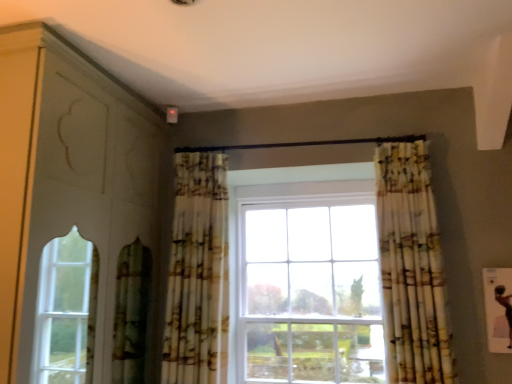
Question: In terms of size, does matte white dresser at left appear bigger or smaller than printed fabric curtain at right, marked as the second curtain in a left-to-right arrangement?

Choices:
 (A) big
 (B) small

Answer: (A)

Question: Relative to printed fabric curtain at right, placed as the 1th curtain when sorted from right to left, is matte white dresser at left in front or behind?

Choices:
 (A) behind
 (B) front

Answer: (B)

Question: Which object is the farthest from the matte white dresser at left?

Choices:
 (A) printed fabric curtain at center, which is the 2th curtain from right to left
 (B) printed fabric curtain at right, placed as the 1th curtain when sorted from right to left

Answer: (B)

Question: Estimate the real-world distances between objects in this image. Which object is farther from the matte white dresser at left?

Choices:
 (A) printed fabric curtain at right, marked as the second curtain in a left-to-right arrangement
 (B) printed fabric curtain at center, placed as the first curtain when sorted from left to right

Answer: (A)